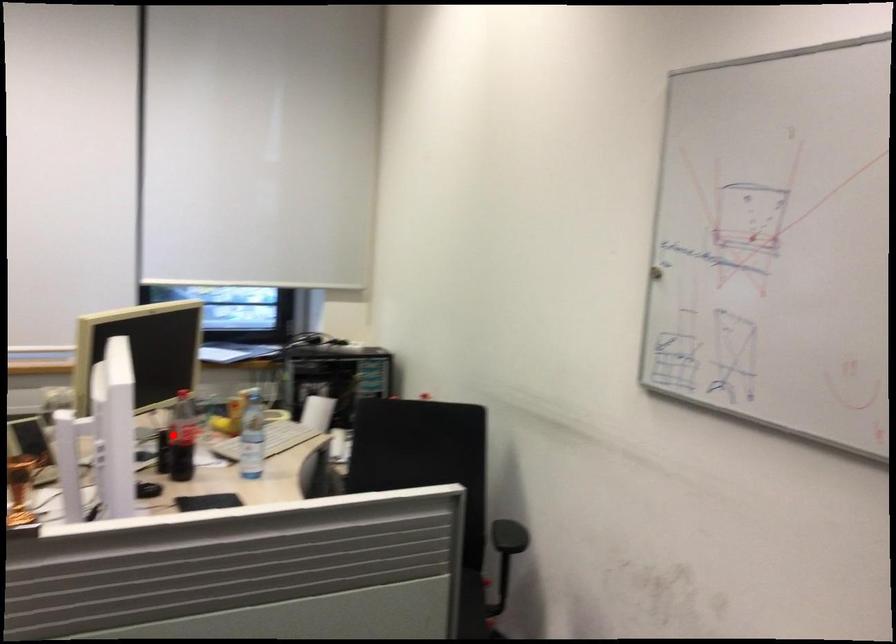
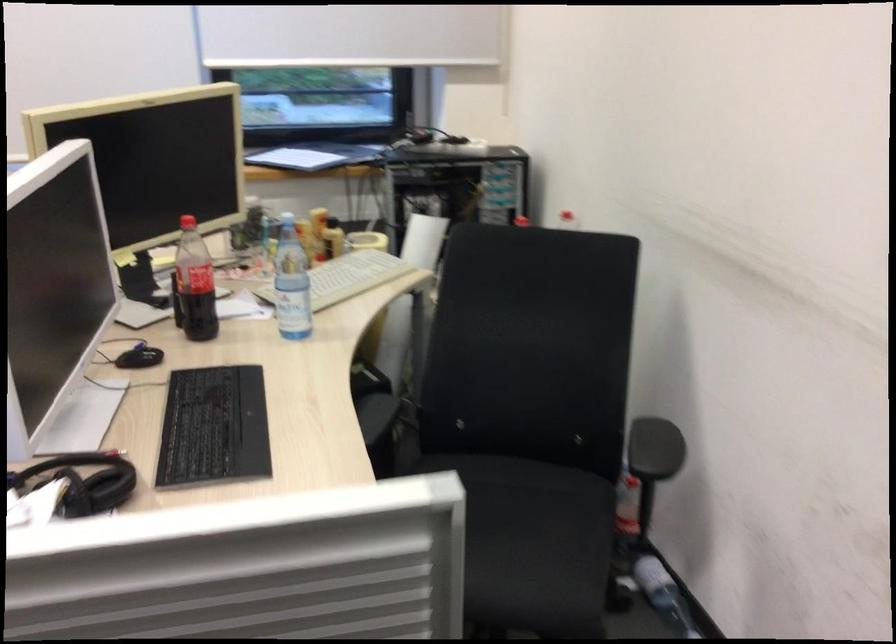
Find the pixel in the second image that matches the highlighted location in the first image.

(194, 283)